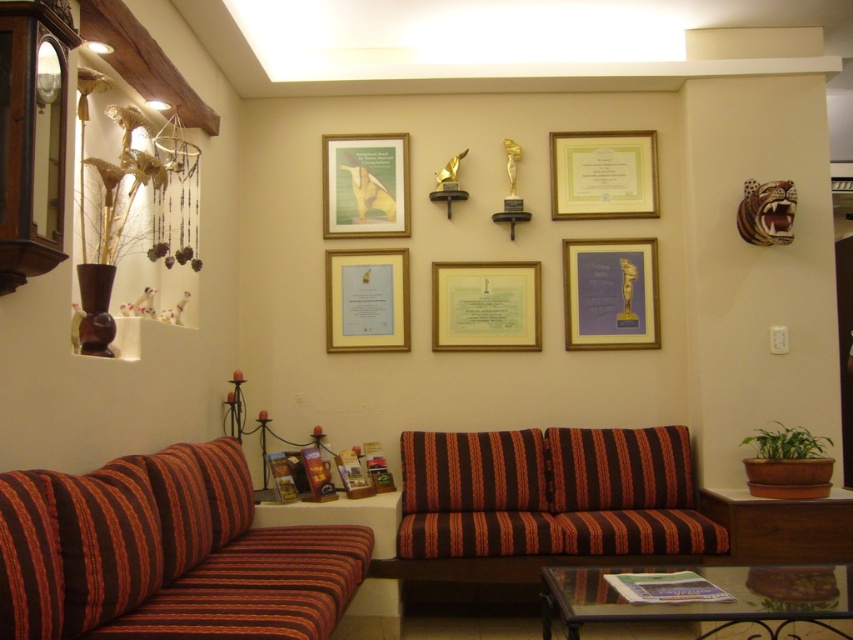
Question: Can you confirm if brown striped couch at center is bigger than matte green paper at center?

Choices:
 (A) no
 (B) yes

Answer: (B)

Question: Can you confirm if striped fabric couch at lower left is positioned below wooden glossy table at lower center?

Choices:
 (A) yes
 (B) no

Answer: (B)

Question: Which object is farther from the camera taking this photo?

Choices:
 (A) gold/metallic picture frame at center
 (B) wooden glossy table at lower center

Answer: (A)

Question: Which point is farther from the camera taking this photo?

Choices:
 (A) (836, 595)
 (B) (323, 157)
 (C) (593, 308)
 (D) (502, 301)

Answer: (B)

Question: Which object is the farthest from the striped fabric couch at lower left?

Choices:
 (A) gold/metallic picture frame at center
 (B) wooden glossy table at lower center
 (C) gold/glossy picture frame at upper center
 (D) matte green paper at center

Answer: (C)

Question: Is brown striped couch at center thinner than green paper certificate at center?

Choices:
 (A) yes
 (B) no

Answer: (B)